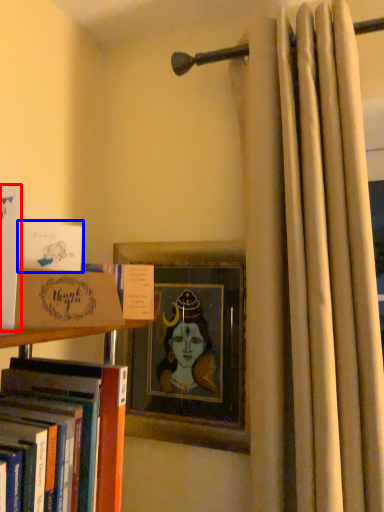
Question: Which object appears closest to the camera in this image, book (highlighted by a red box) or book (highlighted by a blue box)?

Choices:
 (A) book
 (B) book

Answer: (A)